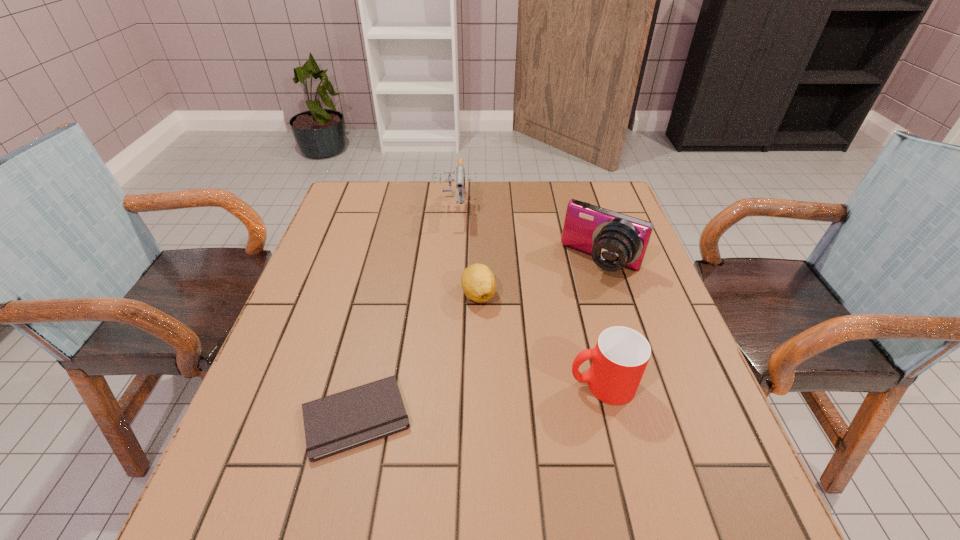
Locate an element on the screen. The height and width of the screenshot is (540, 960). object located in the left edge section of the desktop is located at coordinates (336, 423).

This screenshot has height=540, width=960. In order to click on cup positioned at the right edge in this screenshot , I will do `click(619, 359)`.

Locate an element on the screen. camera that is at the right edge is located at coordinates (614, 240).

This screenshot has height=540, width=960. In order to click on object at the near left corner in this screenshot , I will do click(336, 423).

The width and height of the screenshot is (960, 540). In the image, there is a desktop. Find the location of `vacant area at the far edge`. vacant area at the far edge is located at coordinates (511, 196).

I want to click on free region at the near edge, so click(532, 440).

In the image, there is a desktop. Find the location of `vacant area at the left edge`. vacant area at the left edge is located at coordinates (363, 228).

I want to click on vacant region at the right edge, so click(675, 377).

This screenshot has width=960, height=540. I want to click on free space at the far left corner of the desktop, so click(x=347, y=190).

This screenshot has height=540, width=960. In the image, there is a desktop. Identify the location of vacant area at the near left corner. (300, 454).